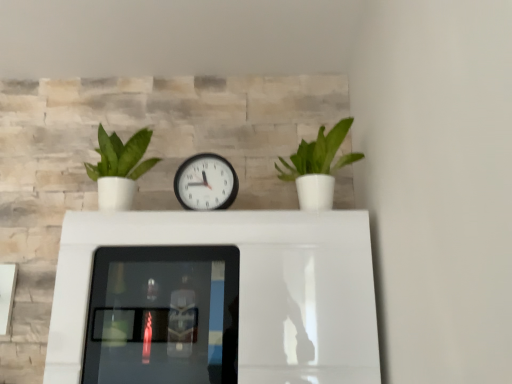
Identify the location of green matte plant at left, the second houseplant in the right-to-left sequence. The width and height of the screenshot is (512, 384). (119, 168).

Measure the distance between white plastic wall clock at center and camera.

A distance of 3.88 feet exists between white plastic wall clock at center and camera.

The image size is (512, 384). Find the location of `green matte plant at left, the first houseplant from the left`. green matte plant at left, the first houseplant from the left is located at coordinates (119, 168).

From the image's perspective, would you say white plastic wall clock at center is positioned over green matte plant at right, which appears as the 1th houseplant when viewed from the right?

No, from the image's perspective, white plastic wall clock at center is not over green matte plant at right, which appears as the 1th houseplant when viewed from the right.

Can you confirm if white plastic wall clock at center is shorter than green matte plant at right, which appears as the 1th houseplant when viewed from the right?

Yes.

Can you confirm if white plastic wall clock at center is smaller than green matte plant at right, the second houseplant when ordered from left to right?

Yes, white plastic wall clock at center is smaller than green matte plant at right, the second houseplant when ordered from left to right.

The image size is (512, 384). What are the coordinates of `houseplant that is the 1st object above the white glossy table at center (from a real-world perspective)` in the screenshot? It's located at (318, 166).

Could green matte plant at right, which appears as the 1th houseplant when viewed from the right, be considered to be inside white glossy table at center?

No, green matte plant at right, which appears as the 1th houseplant when viewed from the right, is not inside white glossy table at center.

How many degrees apart are the facing directions of white glossy table at center and green matte plant at right, the second houseplant when ordered from left to right?

The angle between the facing direction of white glossy table at center and the facing direction of green matte plant at right, the second houseplant when ordered from left to right, is 0.00126 degrees.

Which is behind, white glossy table at center or green matte plant at right, the second houseplant when ordered from left to right?

green matte plant at right, the second houseplant when ordered from left to right, is more distant.

From the image's perspective, is green matte plant at left, the first houseplant from the left, below white plastic wall clock at center?

Actually, green matte plant at left, the first houseplant from the left, appears above white plastic wall clock at center in the image.

Is white plastic wall clock at center completely or partially inside green matte plant at left, the second houseplant in the right-to-left sequence?

No, white plastic wall clock at center is not a part of green matte plant at left, the second houseplant in the right-to-left sequence.

Is green matte plant at left, the second houseplant in the right-to-left sequence, wider than white plastic wall clock at center?

Correct, the width of green matte plant at left, the second houseplant in the right-to-left sequence, exceeds that of white plastic wall clock at center.

Is green matte plant at left, the first houseplant from the left, positioned with its back to white plastic wall clock at center?

No, green matte plant at left, the first houseplant from the left, is not facing away from white plastic wall clock at center.

Can you confirm if white plastic wall clock at center is taller than white glossy table at center?

No, white plastic wall clock at center is not taller than white glossy table at center.

Which is nearer, (213, 202) or (192, 272)?

Point (213, 202) is closer to the camera than point (192, 272).

Can you tell me how much white plastic wall clock at center and white glossy table at center differ in facing direction?

0.000607 degrees.

From the image's perspective, which is below, white plastic wall clock at center or white glossy table at center?

white glossy table at center appears lower in the image.

Locate an element on the screen. table on the left of green matte plant at right, which appears as the 1th houseplant when viewed from the right is located at coordinates (214, 298).

From the image's perspective, which one is positioned higher, green matte plant at right, the second houseplant when ordered from left to right, or white glossy table at center?

green matte plant at right, the second houseplant when ordered from left to right, appears higher in the image.

Is green matte plant at right, which appears as the 1th houseplant when viewed from the right, looking in the opposite direction of white glossy table at center?

green matte plant at right, which appears as the 1th houseplant when viewed from the right, is not turned away from white glossy table at center.

Is green matte plant at right, which appears as the 1th houseplant when viewed from the right, to the right of white glossy table at center from the viewer's perspective?

Yes, green matte plant at right, which appears as the 1th houseplant when viewed from the right, is to the right of white glossy table at center.

From the image's perspective, is green matte plant at right, the second houseplant when ordered from left to right, located above or below white plastic wall clock at center?

Based on their image positions, green matte plant at right, the second houseplant when ordered from left to right, is located above white plastic wall clock at center.

Between green matte plant at right, which appears as the 1th houseplant when viewed from the right, and white plastic wall clock at center, which one has smaller size?

white plastic wall clock at center is smaller.

What's the angular difference between green matte plant at right, which appears as the 1th houseplant when viewed from the right, and white plastic wall clock at center's facing directions?

0.000669 degrees.

Considering the sizes of objects white glossy table at center and green matte plant at left, the first houseplant from the left, in the image provided, who is smaller, white glossy table at center or green matte plant at left, the first houseplant from the left,?

With smaller size is green matte plant at left, the first houseplant from the left.

From a real-world perspective, relative to green matte plant at left, the second houseplant in the right-to-left sequence, is white glossy table at center vertically above or below?

In terms of real-world spatial position, white glossy table at center is below green matte plant at left, the second houseplant in the right-to-left sequence.

Considering the relative sizes of white glossy table at center and green matte plant at left, the second houseplant in the right-to-left sequence, in the image provided, is white glossy table at center shorter than green matte plant at left, the second houseplant in the right-to-left sequence,?

No.

Identify the location of wall clock behind the green matte plant at right, which appears as the 1th houseplant when viewed from the right. The image size is (512, 384). (206, 183).

The width and height of the screenshot is (512, 384). Identify the location of table below the green matte plant at right, the second houseplant when ordered from left to right (from a real-world perspective). (214, 298).

Based on their spatial positions, is green matte plant at right, the second houseplant when ordered from left to right, or green matte plant at left, the second houseplant in the right-to-left sequence, closer to white plastic wall clock at center?

green matte plant at left, the second houseplant in the right-to-left sequence, lies closer to white plastic wall clock at center than the other object.

Which object lies further to the anchor point green matte plant at left, the first houseplant from the left, green matte plant at right, the second houseplant when ordered from left to right, or white glossy table at center?

Among the two, green matte plant at right, the second houseplant when ordered from left to right, is located further to green matte plant at left, the first houseplant from the left.

Looking at the image, which one is located closer to white glossy table at center, green matte plant at right, the second houseplant when ordered from left to right, or green matte plant at left, the first houseplant from the left?

green matte plant at left, the first houseplant from the left, is positioned closer to the anchor white glossy table at center.

When comparing their distances from green matte plant at left, the first houseplant from the left, does white plastic wall clock at center or white glossy table at center seem closer?

white plastic wall clock at center is positioned closer to the anchor green matte plant at left, the first houseplant from the left.

From the image, which object appears to be farther from green matte plant at left, the first houseplant from the left, white glossy table at center or white plastic wall clock at center?

white glossy table at center lies further to green matte plant at left, the first houseplant from the left, than the other object.

Which object lies further to the anchor point white glossy table at center, green matte plant at right, the second houseplant when ordered from left to right, or white plastic wall clock at center?

green matte plant at right, the second houseplant when ordered from left to right.

Considering their positions, is white glossy table at center positioned closer to green matte plant at left, the first houseplant from the left, than green matte plant at right, which appears as the 1th houseplant when viewed from the right?

white glossy table at center.

From the image, which object appears to be farther from white plastic wall clock at center, white glossy table at center or green matte plant at left, the second houseplant in the right-to-left sequence?

white glossy table at center is further to white plastic wall clock at center.

In order to click on table between green matte plant at left, the second houseplant in the right-to-left sequence, and green matte plant at right, which appears as the 1th houseplant when viewed from the right in this screenshot , I will do `click(214, 298)`.

Identify the location of wall clock between green matte plant at left, the first houseplant from the left, and green matte plant at right, which appears as the 1th houseplant when viewed from the right, from left to right. This screenshot has height=384, width=512. click(206, 183).

Where is `wall clock between green matte plant at right, the second houseplant when ordered from left to right, and white glossy table at center in the up-down direction`? The height and width of the screenshot is (384, 512). wall clock between green matte plant at right, the second houseplant when ordered from left to right, and white glossy table at center in the up-down direction is located at coordinates (206, 183).

Identify the location of wall clock between green matte plant at left, the second houseplant in the right-to-left sequence, and white glossy table at center from top to bottom. (206, 183).